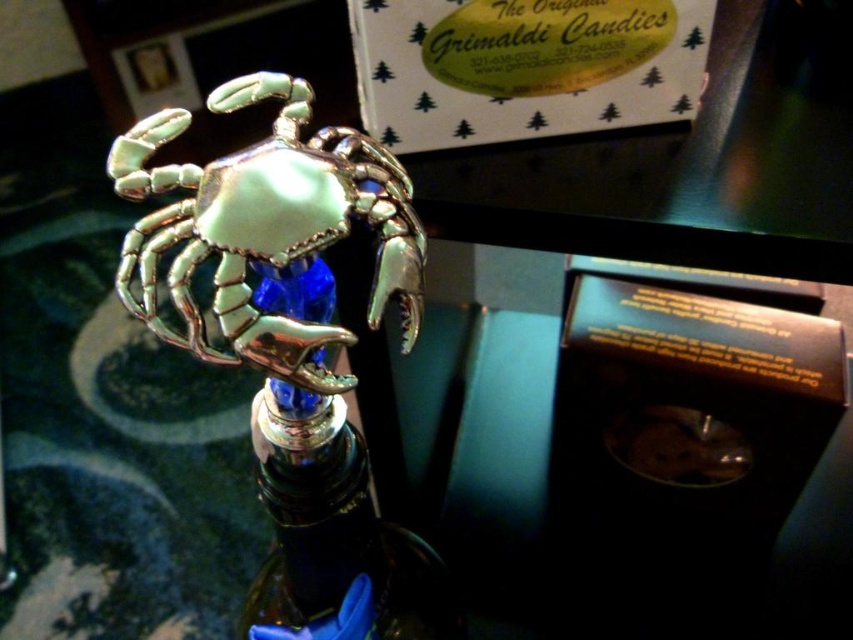
Question: Does shiny silver crab at center appear on the left side of metallic blue glass bottle at center?

Choices:
 (A) yes
 (B) no

Answer: (A)

Question: Which point is farther to the camera?

Choices:
 (A) (399, 634)
 (B) (339, 333)

Answer: (A)

Question: Is shiny silver crab at center smaller than metallic blue glass bottle at center?

Choices:
 (A) yes
 (B) no

Answer: (A)

Question: Is the position of shiny silver crab at center less distant than that of metallic blue glass bottle at center?

Choices:
 (A) yes
 (B) no

Answer: (A)

Question: Which of the following is the closest to the observer?

Choices:
 (A) shiny silver crab at center
 (B) metallic blue glass bottle at center

Answer: (A)